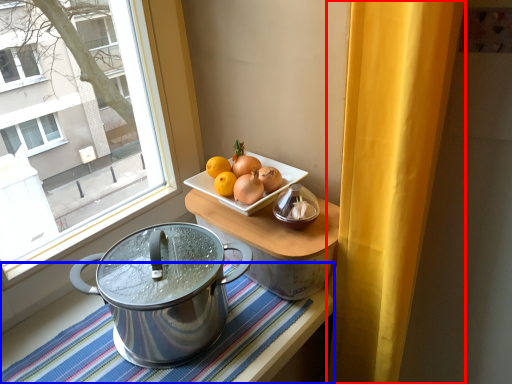
Question: Which object appears farthest to the camera in this image, curtain (highlighted by a red box) or tablecloth (highlighted by a blue box)?

Choices:
 (A) curtain
 (B) tablecloth

Answer: (B)